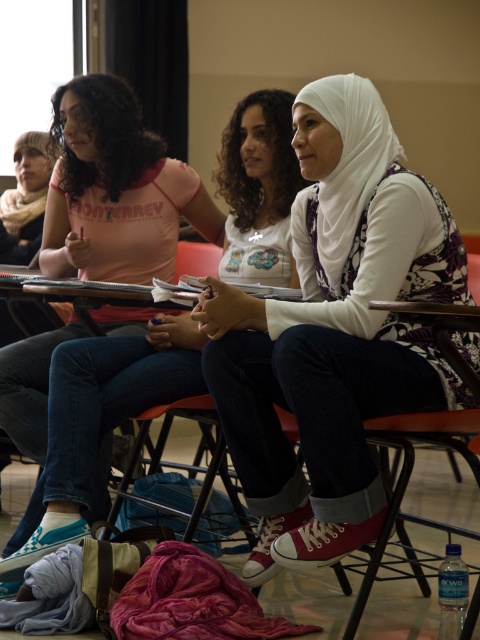
Question: Among these objects, which one is farthest from the camera?

Choices:
 (A) white cotton hijab at center
 (B) metallic red chair at center

Answer: (B)

Question: Which point appears closest to the camera in this image?

Choices:
 (A) (384, 189)
 (B) (113, 404)

Answer: (A)

Question: In this image, where is white cotton hijab at center located relative to metallic red chair at center?

Choices:
 (A) left
 (B) right

Answer: (B)

Question: Does white cotton hijab at center appear on the left side of metallic red chair at center?

Choices:
 (A) yes
 (B) no

Answer: (B)

Question: Does white cotton hijab at center have a smaller size compared to metallic red chair at center?

Choices:
 (A) no
 (B) yes

Answer: (A)